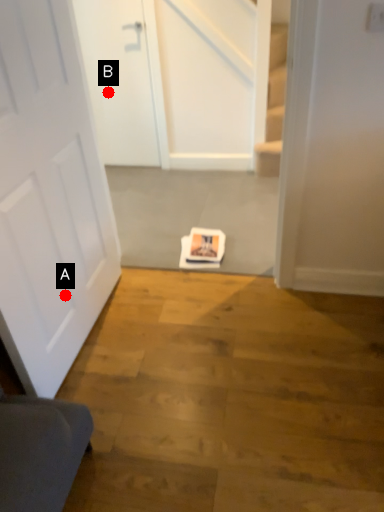
Question: Two points are circled on the image, labeled by A and B beside each circle. Which of the following is the closest to the observer?

Choices:
 (A) A is closer
 (B) B is closer

Answer: (A)